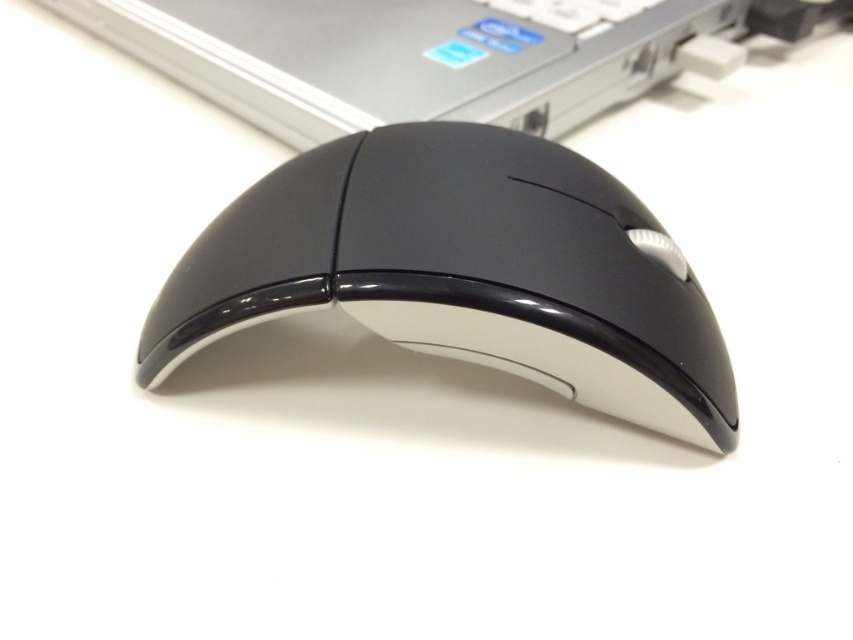
Question: Which point is closer to the camera taking this photo?

Choices:
 (A) (485, 0)
 (B) (625, 17)
 (C) (437, 168)

Answer: (C)

Question: Which object is positioned closest to the satin silver keyboard at upper center?

Choices:
 (A) black glossy mouse at center
 (B) black glossy mouse at upper center

Answer: (B)

Question: Is black glossy mouse at center to the left of black glossy mouse at upper center from the viewer's perspective?

Choices:
 (A) yes
 (B) no

Answer: (B)

Question: Can you confirm if black glossy mouse at upper center is smaller than satin silver keyboard at upper center?

Choices:
 (A) yes
 (B) no

Answer: (B)

Question: Can you confirm if black glossy mouse at center is thinner than satin silver keyboard at upper center?

Choices:
 (A) yes
 (B) no

Answer: (B)

Question: Estimate the real-world distances between objects in this image. Which object is farther from the black glossy mouse at upper center?

Choices:
 (A) black glossy mouse at center
 (B) satin silver keyboard at upper center

Answer: (A)